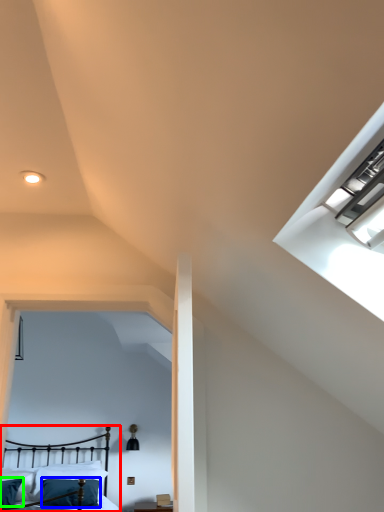
Question: Considering the real-world distances, which object is closest to bed (highlighted by a red box)? pillow (highlighted by a blue box) or pillow (highlighted by a green box).

Choices:
 (A) pillow
 (B) pillow

Answer: (A)